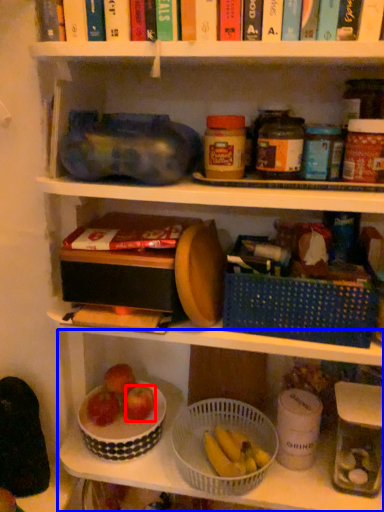
Question: Which object is closer to the camera taking this photo, apple (highlighted by a red box) or shelf (highlighted by a blue box)?

Choices:
 (A) apple
 (B) shelf

Answer: (B)